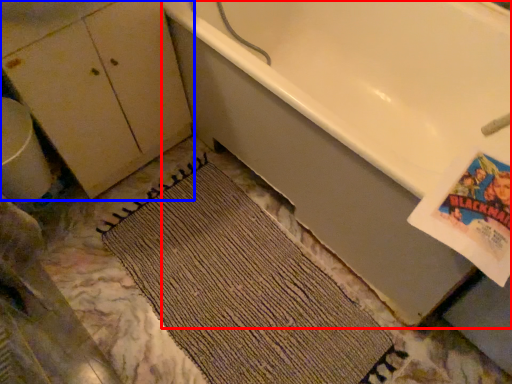
Question: Which object appears farthest to the camera in this image, bathtub (highlighted by a red box) or dresser (highlighted by a blue box)?

Choices:
 (A) bathtub
 (B) dresser

Answer: (B)